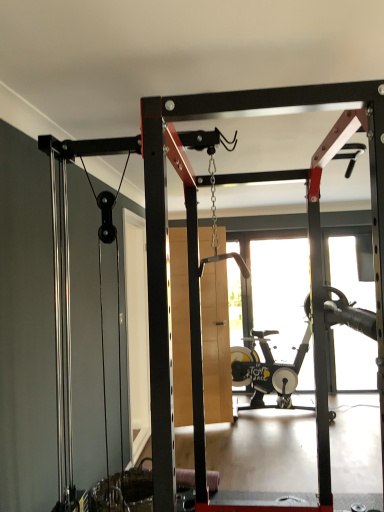
Question: From the image's perspective, is black rubber stationary bicycle at center positioned above or below wooden at center?

Choices:
 (A) below
 (B) above

Answer: (A)

Question: Considering the positions of black rubber stationary bicycle at center and wooden at center in the image, is black rubber stationary bicycle at center bigger or smaller than wooden at center?

Choices:
 (A) big
 (B) small

Answer: (A)

Question: Is point (284, 393) positioned closer to the camera than point (178, 312)?

Choices:
 (A) farther
 (B) closer

Answer: (A)

Question: Is wooden at center spatially inside black rubber stationary bicycle at center, or outside of it?

Choices:
 (A) outside
 (B) inside

Answer: (A)

Question: From the image's perspective, is wooden at center above or below black rubber stationary bicycle at center?

Choices:
 (A) below
 (B) above

Answer: (B)

Question: In terms of height, does wooden at center look taller or shorter compared to black rubber stationary bicycle at center?

Choices:
 (A) short
 (B) tall

Answer: (B)

Question: Considering the positions of point (183, 304) and point (327, 324), is point (183, 304) closer or farther from the camera than point (327, 324)?

Choices:
 (A) closer
 (B) farther

Answer: (B)